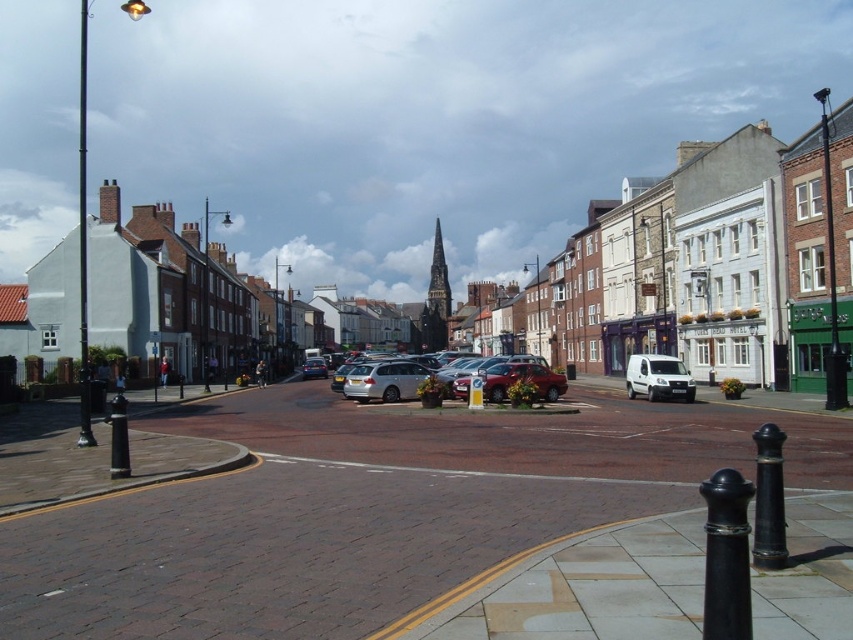
You are standing on the brick pavement at center and want to take a photo of the white matte van at center. Which object is closer to your camera lens when you take the photo?

The brick pavement at center is closer to the viewer than the white matte van at center, so the brick pavement at center will be closer to the camera lens when taking the photo.

You are standing on the brick pavement at center and want to walk to the residential houses on the left side of the street. Which direction should you head?

Since the brick pavement at center is located at point (367, 509), you should head to the left to reach the residential houses on the left side of the street.